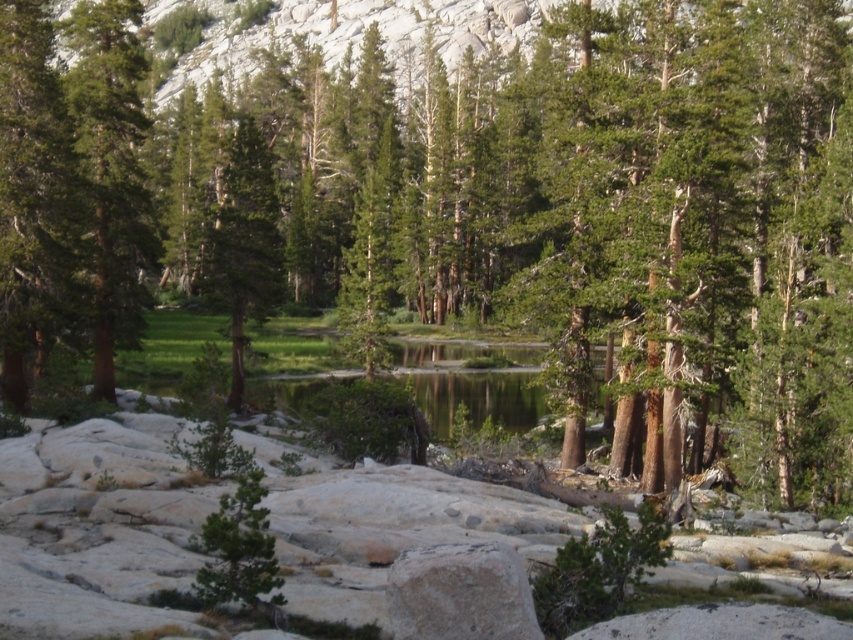
Based on the photo, you are standing in the forest and see the green matte tree at left and the green matte tree at center. Which tree is closer to the ground?

The green matte tree at left is located below the green matte tree at center, so it is closer to the ground.